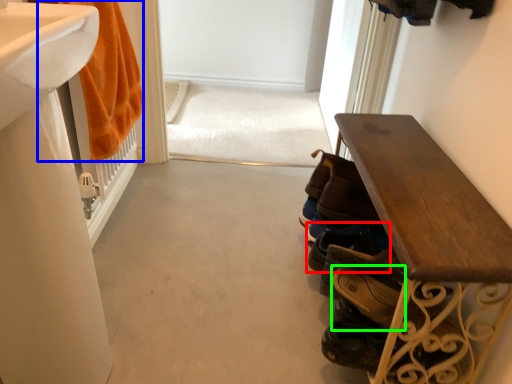
Question: Which object is the farthest from footwear (highlighted by a red box)? Choose among these: bath towel (highlighted by a blue box) or shoe (highlighted by a green box).

Choices:
 (A) bath towel
 (B) shoe

Answer: (A)